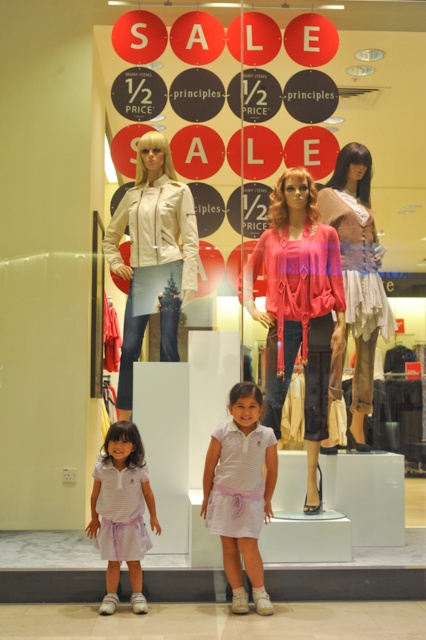
Question: Observing the image, what is the correct spatial positioning of pale purple cotton dress at lower left in reference to pink satin dress at center?

Choices:
 (A) above
 (B) below

Answer: (B)

Question: Which object is closer to the camera taking this photo?

Choices:
 (A) white striped shirt at center
 (B) pink satin dress at center

Answer: (A)

Question: Among these points, which one is nearest to the camera?

Choices:
 (A) (126, 554)
 (B) (104, 556)

Answer: (A)

Question: Considering the relative positions of pink fabric dress at center and pale pink satin dress at lower left in the image provided, where is pink fabric dress at center located with respect to pale pink satin dress at lower left?

Choices:
 (A) left
 (B) right

Answer: (B)

Question: Considering the real-world distances, which object is farthest from the pale pink satin dress at lower left?

Choices:
 (A) white striped dress at center
 (B) white striped shirt at center
 (C) pale purple cotton dress at lower left

Answer: (A)

Question: Is pink fabric blouse at center to the right of pink fabric dress at center from the viewer's perspective?

Choices:
 (A) no
 (B) yes

Answer: (A)